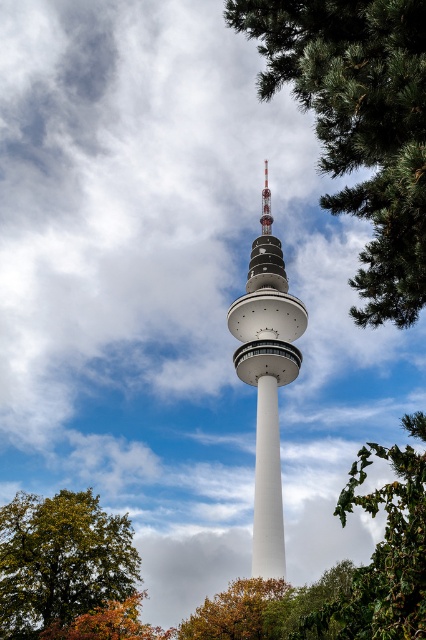
Is point (279, 336) farther from viewer compared to point (236, 621)?

Yes, point (279, 336) is behind point (236, 621).

Can you confirm if white smooth tower at center is positioned above autumn leaves at lower center?

Indeed, white smooth tower at center is positioned over autumn leaves at lower center.

Who is more forward, (259, 538) or (282, 612)?

Point (282, 612)

Locate an element on the screen. This screenshot has width=426, height=640. white smooth tower at center is located at coordinates (267, 378).

Does point (411, 243) lie behind point (126, 520)?

No, it is not.

Can you confirm if green textured pine tree at upper right is positioned above green leafy tree at lower left?

Indeed, green textured pine tree at upper right is positioned over green leafy tree at lower left.

Which is in front, point (386, 3) or point (39, 528)?

Point (386, 3) is more forward.

The image size is (426, 640). Find the location of `green textured pine tree at upper right`. green textured pine tree at upper right is located at coordinates (359, 124).

Does point (386, 628) come behind point (270, 346)?

No, it is in front of (270, 346).

Who is taller, green leafy tree at lower right or white smooth tower at center?

With more height is white smooth tower at center.

You are a GUI agent. You are given a task and a screenshot of the screen. Output one action in this format:
    pyautogui.click(x=<x>, y=<y>)
    Task: Click on the green leafy tree at lower right
    
    Given the screenshot: What is the action you would take?
    pyautogui.click(x=382, y=556)